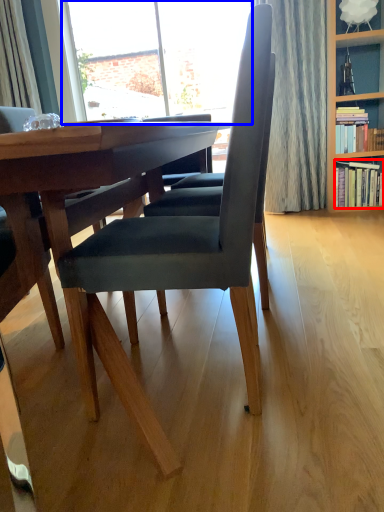
Question: Which of the following is the closest to the observer, book (highlighted by a red box) or window (highlighted by a blue box)?

Choices:
 (A) book
 (B) window

Answer: (A)